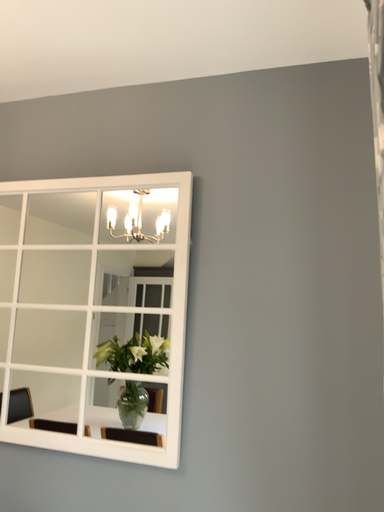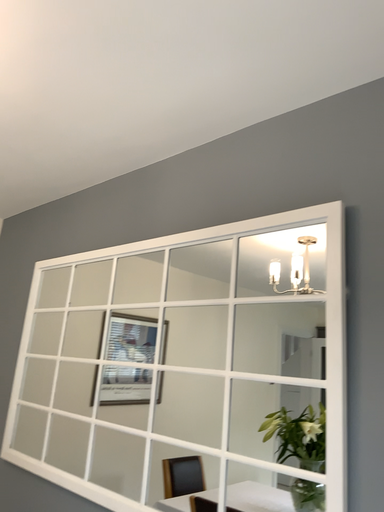
Question: Which way did the camera rotate in the video?

Choices:
 (A) rotated right
 (B) rotated left

Answer: (B)